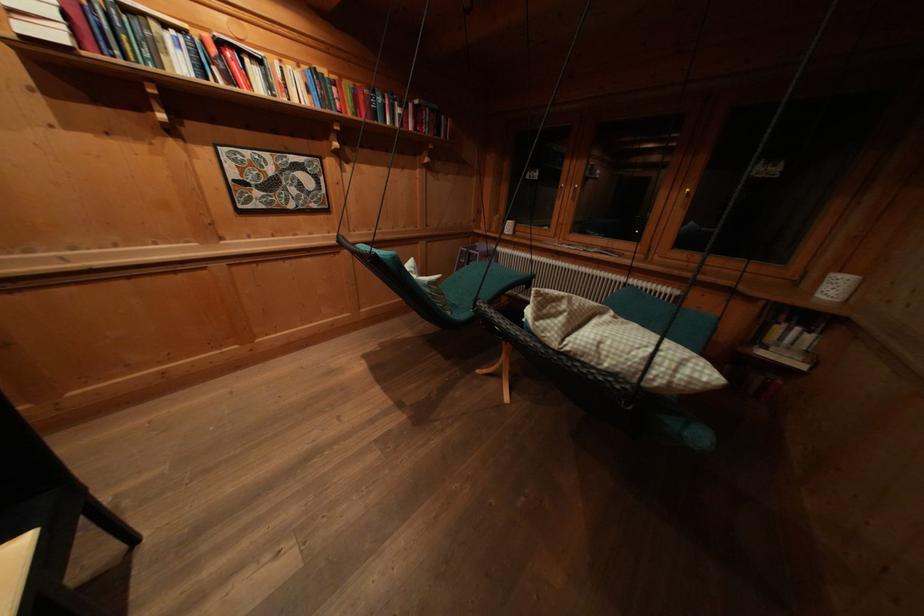
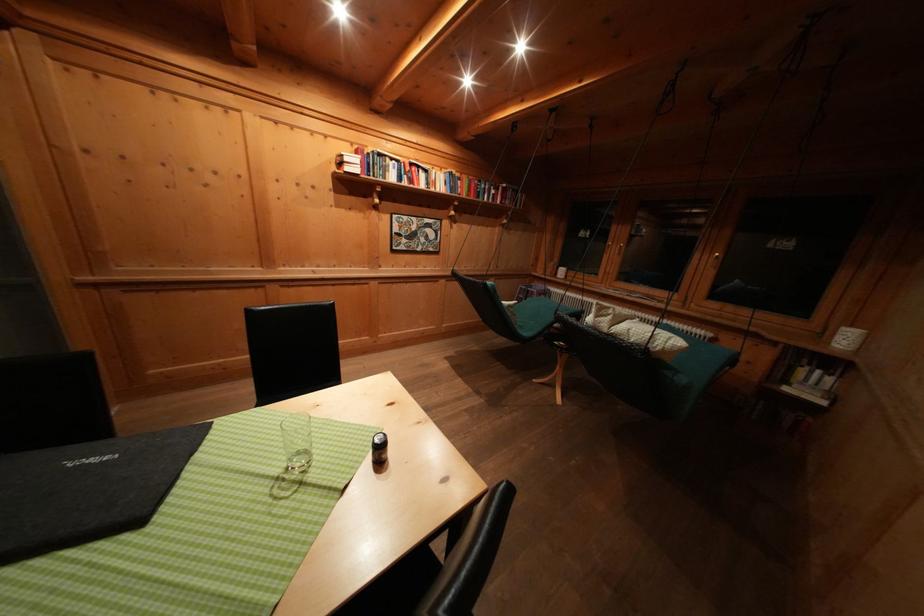
Where in the second image is the point corresponding to (x=561, y=350) from the first image?

(612, 334)